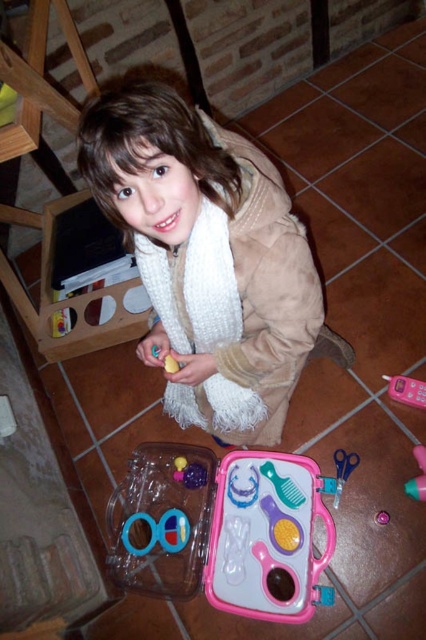
Question: Can you confirm if white fuzzy scarf at center is smaller than pink plastic toy phone at lower right?

Choices:
 (A) yes
 (B) no

Answer: (B)

Question: In this image, where is pink plastic toy phone at lower right located relative to pink plastic toy at lower right?

Choices:
 (A) left
 (B) right

Answer: (B)

Question: Can you confirm if blue rubber rings at lower center is positioned to the right of pink plastic toy at lower right?

Choices:
 (A) no
 (B) yes

Answer: (A)

Question: Which of the following is the farthest from the observer?

Choices:
 (A) (408, 392)
 (B) (175, 371)
 (C) (339, 493)

Answer: (A)

Question: Which point appears farthest from the camera in this image?

Choices:
 (A) (187, 204)
 (B) (170, 515)
 (C) (417, 451)

Answer: (B)

Question: Estimate the real-world distances between objects in this image. Which object is closer to the matte yellow rubber at center?

Choices:
 (A) pink plastic toy phone at lower right
 (B) pink plastic toy at lower right
 (C) white fuzzy scarf at center

Answer: (C)